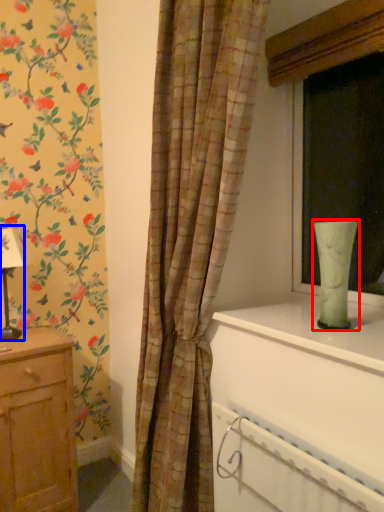
Question: Which point is further to the camera, glass vase (highlighted by a red box) or table lamp (highlighted by a blue box)?

Choices:
 (A) glass vase
 (B) table lamp

Answer: (B)